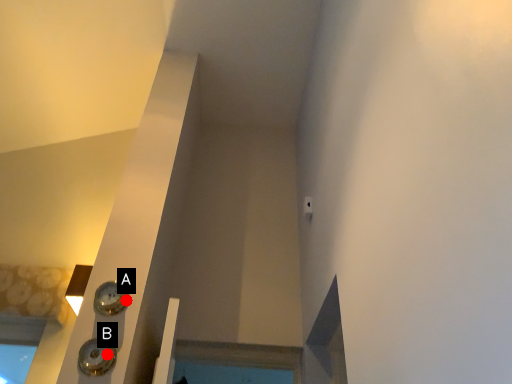
Question: Two points are circled on the image, labeled by A and B beside each circle. Which point is closer to the camera taking this photo?

Choices:
 (A) A is closer
 (B) B is closer

Answer: (B)